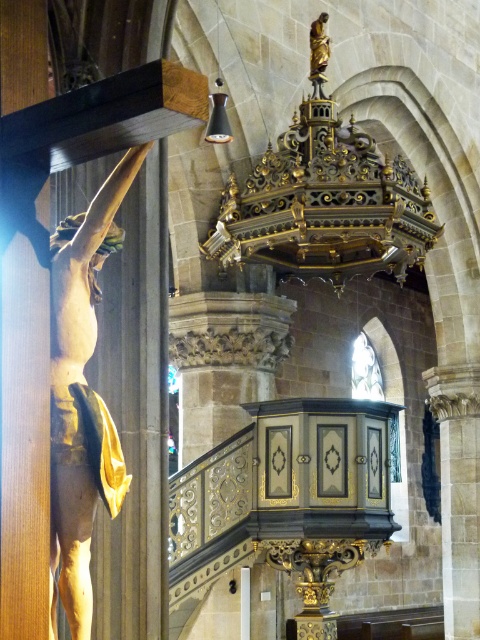
Is the position of matte gold statue at left more distant than that of gold polished wood statue at upper center?

No.

Is point (73, 484) positioned after point (310, 65)?

No.

Which is behind, point (54, 595) or point (319, 68)?

Point (319, 68)

The image size is (480, 640). Find the location of `matte gold statue at left`. matte gold statue at left is located at coordinates (79, 381).